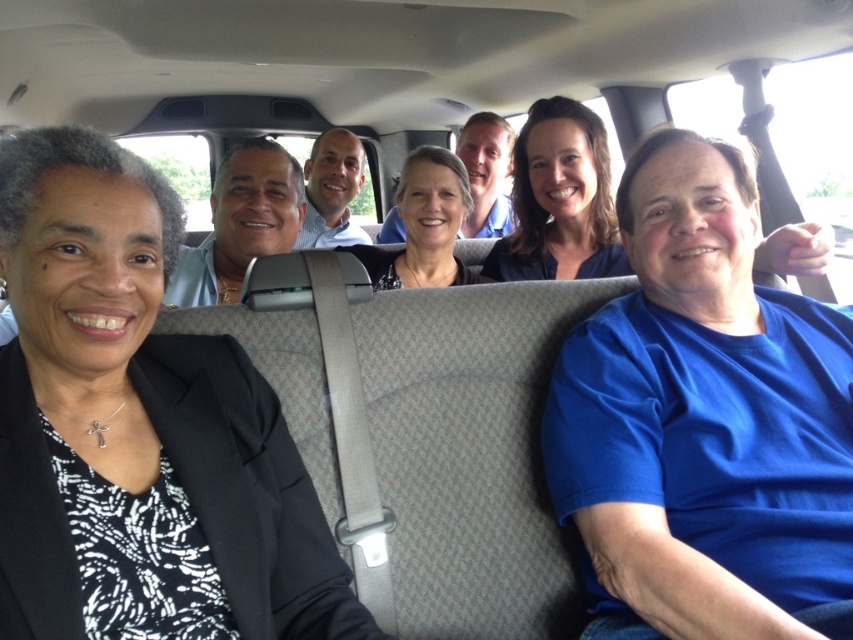
You are standing in front of the van and want to take a photo of the point at coordinates point (53,132). Considering the distance, will you need to zoom in or zoom out to capture it clearly?

The point (53,132) is 38.72 inches from the camera, which is a moderate distance. To capture it clearly, you might need to zoom in slightly to ensure the point is in focus and occupies a reasonable portion of the frame.

Looking at this image, you are a photographer positioned outside the van. You want to take a photo of the passengers through the window. The black matte blazer at left and the matte black hair at center are both in your view. Which object appears taller in the photo?

The black matte blazer at left appears taller than the matte black hair at center in the photo because the black matte blazer at left is taller than matte black hair at center according to the description.

You are sitting in the front passenger seat of the van and want to know which of the two points, point (x=253, y=429) or point (x=416, y=272), is closer to you. Can you determine this based on the scene?

Point (x=253, y=429) is closer to the viewer than point (x=416, y=272).